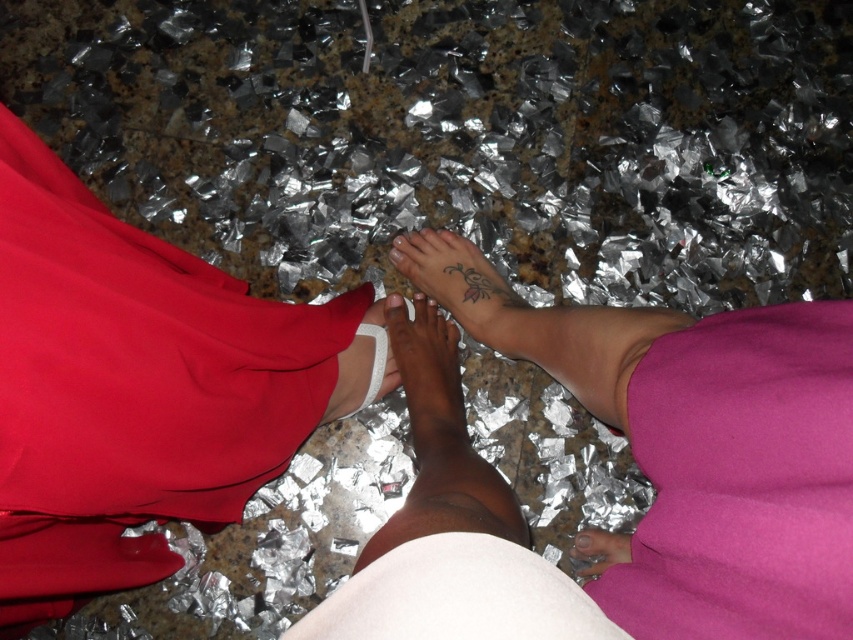
Question: Which is nearer to the gray matte toe at center?

Choices:
 (A) matte skin tattoo at center
 (B) brown matte toe at center
 (C) white fabric at center

Answer: (A)

Question: Does purple matte dress at lower right appear on the right side of brown matte toe at center?

Choices:
 (A) yes
 (B) no

Answer: (A)

Question: Is matte skin tattoo at center above brown matte toe at center?

Choices:
 (A) no
 (B) yes

Answer: (A)

Question: Which object is the farthest from the matte red dress at left?

Choices:
 (A) gray matte toe at center
 (B) smooth skin tattoo at center

Answer: (A)

Question: Among these objects, which one is nearest to the camera?

Choices:
 (A) white fabric at center
 (B) matte skin tattoo at center
 (C) gray matte toe at center

Answer: (B)

Question: Can you confirm if matte red dress at left is smaller than brown matte toe at center?

Choices:
 (A) no
 (B) yes

Answer: (A)